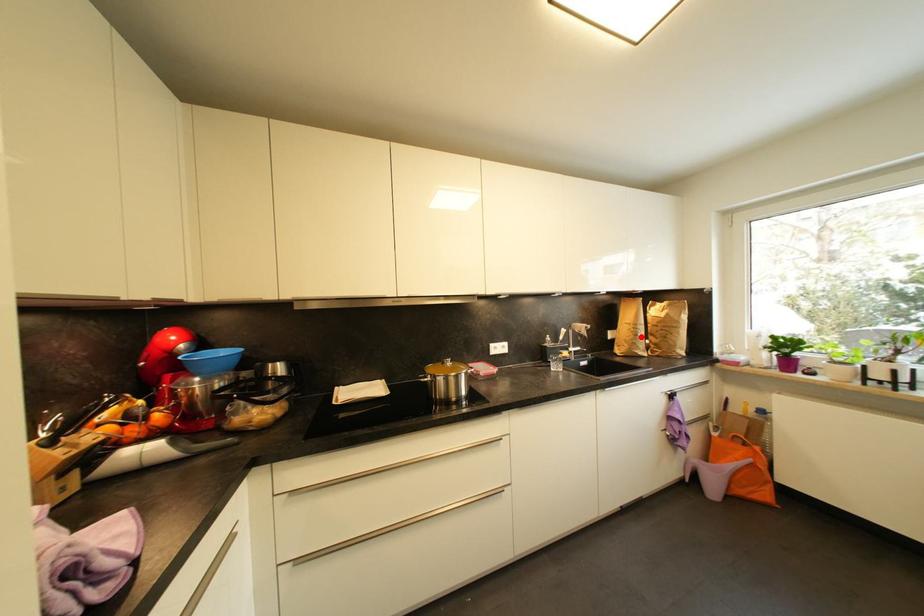
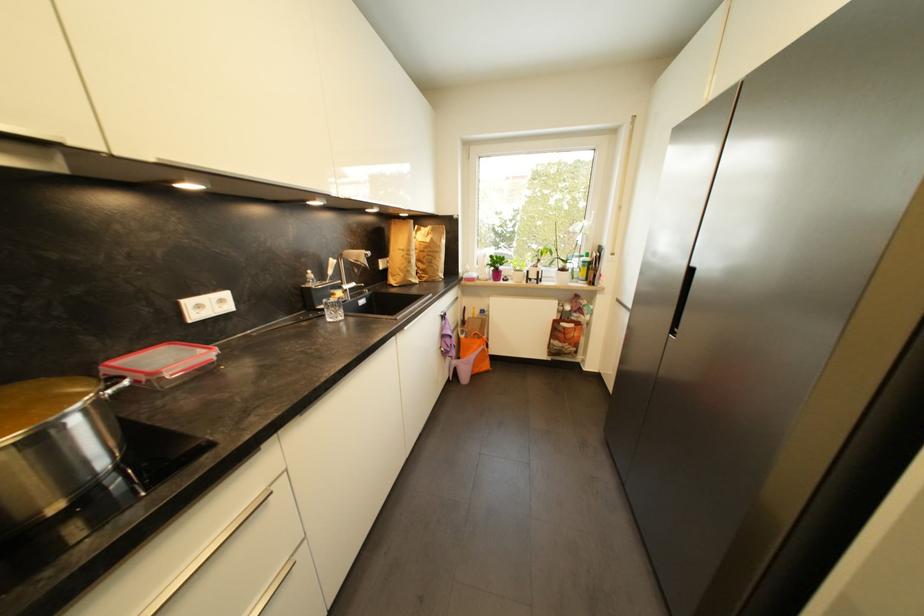
Question: I am providing you with two images of the same scene from different viewpoints. Given a red point in image1, look at the same physical point in image2. Is it:

Choices:
 (A) Closer to the viewpoint
 (B) Farther from the viewpoint

Answer: (A)